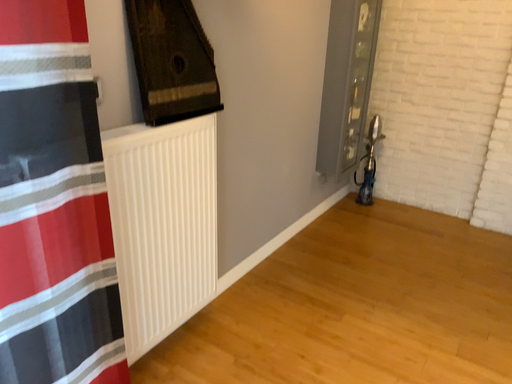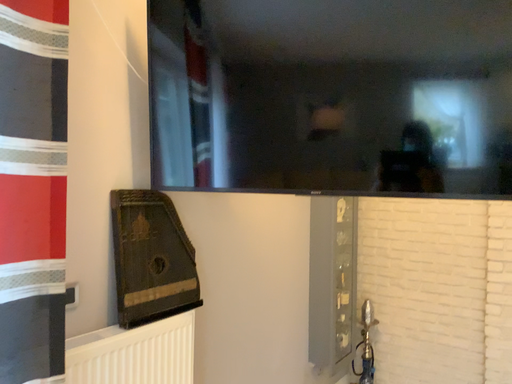
Question: Which way did the camera rotate in the video?

Choices:
 (A) rotated downward
 (B) rotated upward

Answer: (B)